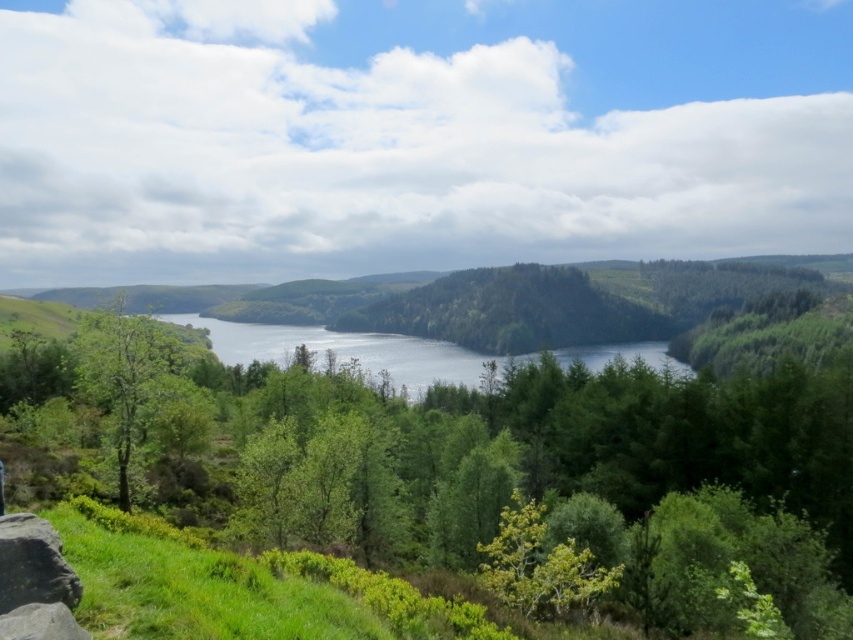
You are planning to place a small wooden bench on the shore. The bench requires a space wider than the smooth gray rock at lower left. Based on the scene, is the clear blue water at center a suitable location for the bench?

The clear blue water at center is wider than the smooth gray rock at lower left. Therefore, the clear blue water at center is suitable for placing the bench as it provides enough width.

Based on the coordinates provided, where is the clear blue water at center located in the image?

The clear blue water at center is located at the coordinates point (349, 349).